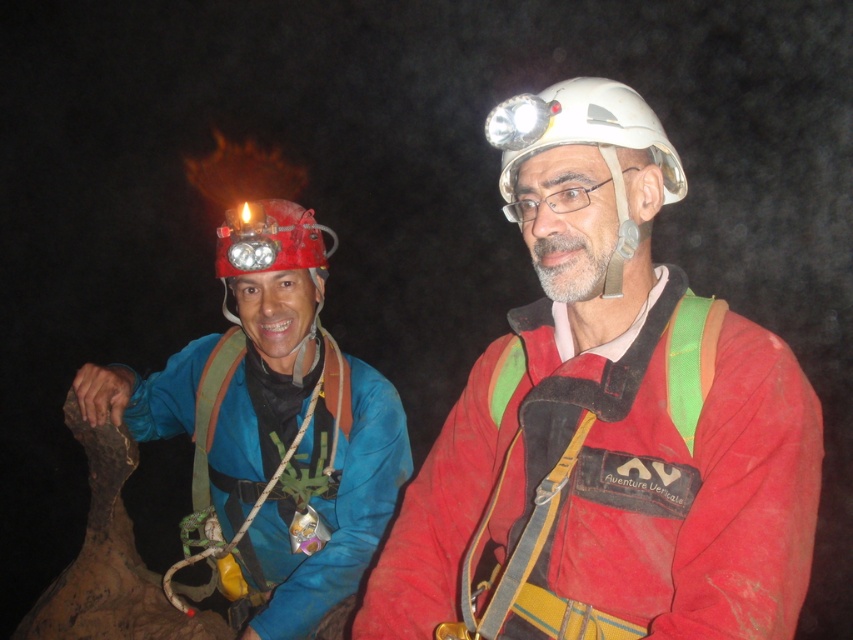
Can you confirm if matte red jacket at center is shorter than matte blue jacket at left?

Correct, matte red jacket at center is not as tall as matte blue jacket at left.

Who is more forward, (543, 157) or (233, 380)?

Positioned in front is point (543, 157).

In order to click on matte red jacket at center in this screenshot , I will do `click(606, 422)`.